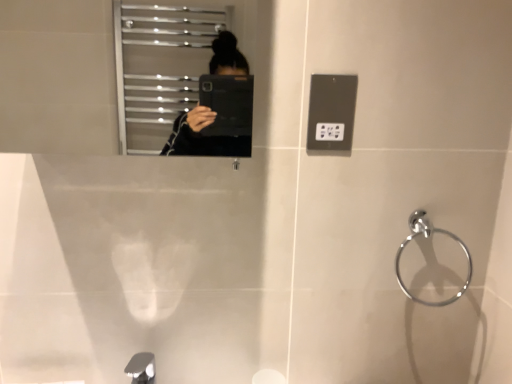
Question: Is chrome metallic towel ring at right located within silver metallic tap at lower left?

Choices:
 (A) no
 (B) yes

Answer: (A)

Question: Considering the relative sizes of silver metallic tap at lower left and chrome metallic towel ring at right in the image provided, is silver metallic tap at lower left thinner than chrome metallic towel ring at right?

Choices:
 (A) yes
 (B) no

Answer: (B)

Question: From the image's perspective, is silver metallic tap at lower left beneath chrome metallic towel ring at right?

Choices:
 (A) no
 (B) yes

Answer: (B)

Question: From a real-world perspective, is silver metallic tap at lower left under chrome metallic towel ring at right?

Choices:
 (A) yes
 (B) no

Answer: (A)

Question: Could you tell me if silver metallic tap at lower left is turned towards chrome metallic towel ring at right?

Choices:
 (A) yes
 (B) no

Answer: (B)

Question: From a real-world perspective, is chrome metallic towel ring at right physically located above or below silver metallic tap at lower left?

Choices:
 (A) below
 (B) above

Answer: (B)

Question: Looking at their shapes, would you say chrome metallic towel ring at right is wider or thinner than silver metallic tap at lower left?

Choices:
 (A) thin
 (B) wide

Answer: (A)

Question: Based on their sizes in the image, would you say chrome metallic towel ring at right is bigger or smaller than silver metallic tap at lower left?

Choices:
 (A) big
 (B) small

Answer: (A)

Question: Is chrome metallic towel ring at right situated inside silver metallic tap at lower left or outside?

Choices:
 (A) outside
 (B) inside

Answer: (A)

Question: In terms of height, does silver metallic tap at lower left look taller or shorter compared to chrome metallic towel ring at right?

Choices:
 (A) short
 (B) tall

Answer: (A)

Question: In terms of size, does silver metallic tap at lower left appear bigger or smaller than chrome metallic towel ring at right?

Choices:
 (A) small
 (B) big

Answer: (A)

Question: From a real-world perspective, is silver metallic tap at lower left positioned above or below chrome metallic towel ring at right?

Choices:
 (A) above
 (B) below

Answer: (B)

Question: Visually, is silver metallic tap at lower left positioned to the left or to the right of chrome metallic towel ring at right?

Choices:
 (A) left
 (B) right

Answer: (A)

Question: From a real-world perspective, is metallic gray outlet at upper right positioned above or below silver metallic tap at lower left?

Choices:
 (A) below
 (B) above

Answer: (B)

Question: Is metallic gray outlet at upper right in front of or behind silver metallic tap at lower left in the image?

Choices:
 (A) behind
 (B) front

Answer: (A)